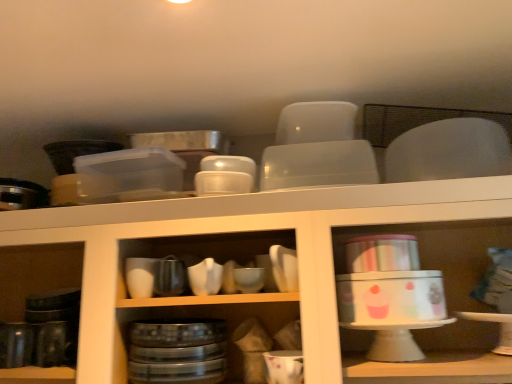
Question: Is matte white bowl at center, which appears as the fourth tableware when viewed from the right, positioned before white glossy mug at lower center, the second tableware in the right-to-left sequence?

Choices:
 (A) yes
 (B) no

Answer: (B)

Question: Is matte white bowl at center, the second tableware from the left, at the left side of white glossy mug at lower center, the second tableware in the right-to-left sequence?

Choices:
 (A) yes
 (B) no

Answer: (A)

Question: Is matte white bowl at center, the second tableware from the left, smaller than white glossy mug at lower center, placed as the fourth tableware when sorted from left to right?

Choices:
 (A) yes
 (B) no

Answer: (A)

Question: Is matte white bowl at center, the second tableware from the left, shorter than white glossy mug at lower center, placed as the fourth tableware when sorted from left to right?

Choices:
 (A) yes
 (B) no

Answer: (A)

Question: Is matte white bowl at center, the second tableware from the left, further to camera compared to white glossy mug at lower center, the second tableware in the right-to-left sequence?

Choices:
 (A) yes
 (B) no

Answer: (A)

Question: Would you say white glossy cake stand at center, marked as the first shelf in a left-to-right arrangement, is inside or outside shiny black mug at left, the 5th tableware viewed from the right?

Choices:
 (A) inside
 (B) outside

Answer: (B)

Question: Does point (62, 256) appear closer or farther from the camera than point (14, 362)?

Choices:
 (A) farther
 (B) closer

Answer: (A)

Question: From the image's perspective, relative to shiny black mug at left, the 5th tableware viewed from the right, is white glossy cake stand at center, the 2th shelf viewed from the right, above or below?

Choices:
 (A) below
 (B) above

Answer: (B)

Question: Is white glossy cake stand at center, the 2th shelf viewed from the right, wider or thinner than shiny black mug at left, the 5th tableware viewed from the right?

Choices:
 (A) wide
 (B) thin

Answer: (A)

Question: Relative to matte white bowl at center, which appears as the fourth tableware when viewed from the right, is shiny black mug at left, the 5th tableware viewed from the right, in front or behind?

Choices:
 (A) front
 (B) behind

Answer: (B)

Question: Choose the correct answer: Is shiny black mug at left, the 5th tableware viewed from the right, inside matte white bowl at center, the second tableware from the left, or outside it?

Choices:
 (A) outside
 (B) inside

Answer: (A)

Question: Is point (12, 349) closer or farther from the camera than point (210, 278)?

Choices:
 (A) farther
 (B) closer

Answer: (A)

Question: Is shiny black mug at left, the 5th tableware viewed from the right, wider or thinner than matte white bowl at center, which appears as the fourth tableware when viewed from the right?

Choices:
 (A) wide
 (B) thin

Answer: (A)

Question: From the image's perspective, is white glossy cake stand at center, the 2th shelf viewed from the right, located above or below matte white bowl at center, the second tableware from the left?

Choices:
 (A) above
 (B) below

Answer: (B)

Question: Is white glossy cake stand at center, the 2th shelf viewed from the right, taller or shorter than matte white bowl at center, the second tableware from the left?

Choices:
 (A) short
 (B) tall

Answer: (B)